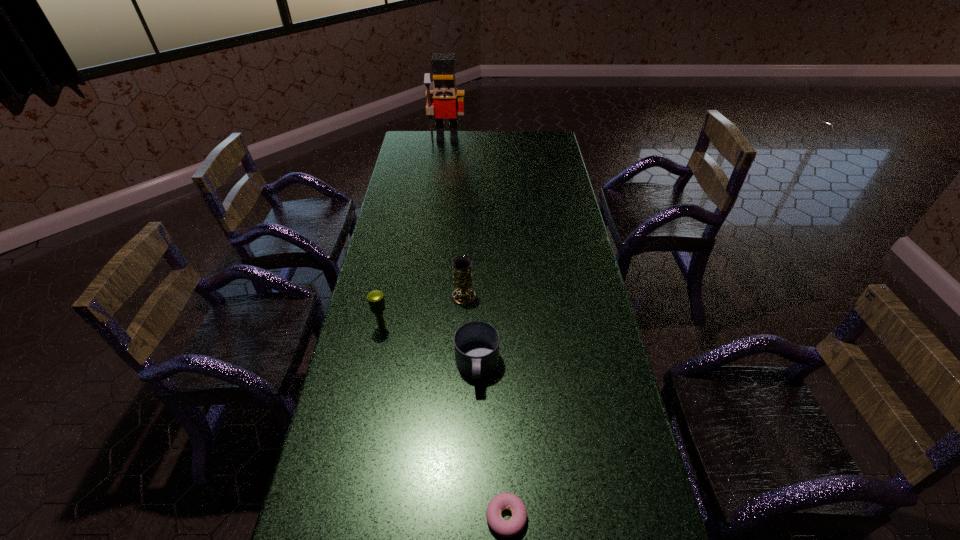
You are a GUI agent. You are given a task and a screenshot of the screen. Output one action in this format:
    pyautogui.click(x=<x>, y=<y>)
    Task: Click on the vacant area that lies between the fourth nearest object and the leftmost object
    
    Given the screenshot: What is the action you would take?
    pyautogui.click(x=423, y=313)

Image resolution: width=960 pixels, height=540 pixels. Find the location of `empty space that is in between the second farthest object and the fifth farthest object`. empty space that is in between the second farthest object and the fifth farthest object is located at coordinates (479, 286).

In order to click on object that stands as the third closest to the doughnut in this screenshot , I will do coord(462,265).

Find the location of a particular element. Image resolution: width=960 pixels, height=540 pixels. object identified as the fifth closest to the farthest object is located at coordinates (509, 528).

The image size is (960, 540). What are the coordinates of `blank area in the image that satisfies the following two spatial constraints: 1. on the side of the doughnut with the handle; 2. on the left side of the second nearest object` in the screenshot? It's located at (476, 517).

The width and height of the screenshot is (960, 540). I want to click on free space in the image that satisfies the following two spatial constraints: 1. in front of the nutcracker holding the staff; 2. on the left side of the chalice, so click(429, 297).